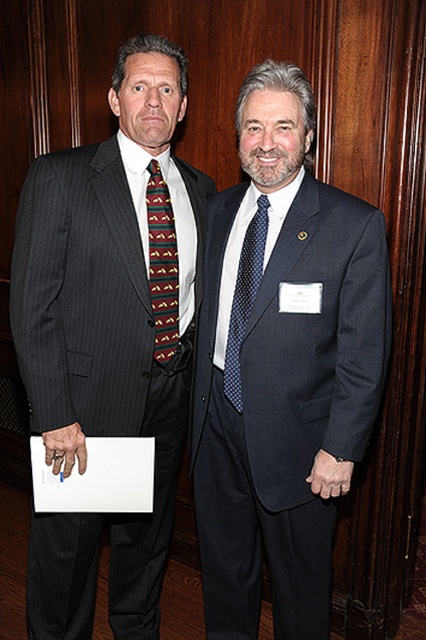
Question: Is dark blue textured suit at center smaller than pinstriped suit at left?

Choices:
 (A) no
 (B) yes

Answer: (B)

Question: Estimate the real-world distances between objects in this image. Which object is closer to the blue dotted tie at center?

Choices:
 (A) pinstriped suit at left
 (B) dark blue textured suit at center

Answer: (B)

Question: Does pinstriped suit at left have a larger size compared to multicolored woven tie at center?

Choices:
 (A) yes
 (B) no

Answer: (A)

Question: From the image, what is the correct spatial relationship of multicolored woven tie at center in relation to blue dotted tie at center?

Choices:
 (A) below
 (B) above

Answer: (B)

Question: Which object is positioned farthest from the dark blue textured suit at center?

Choices:
 (A) multicolored woven tie at center
 (B) blue dotted tie at center

Answer: (A)

Question: Which point is closer to the camera?

Choices:
 (A) pinstriped suit at left
 (B) dark blue textured suit at center
 (C) multicolored woven tie at center

Answer: (B)